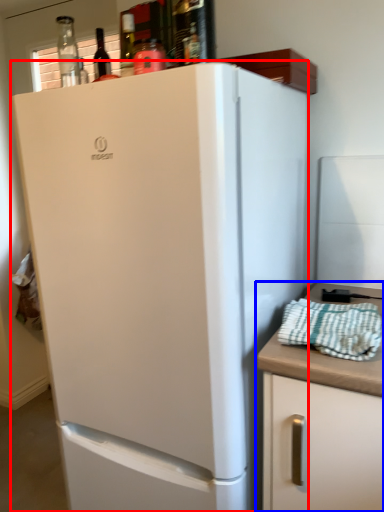
Question: Which object appears farthest to the camera in this image, refrigerator (highlighted by a red box) or cabinetry (highlighted by a blue box)?

Choices:
 (A) refrigerator
 (B) cabinetry

Answer: (B)